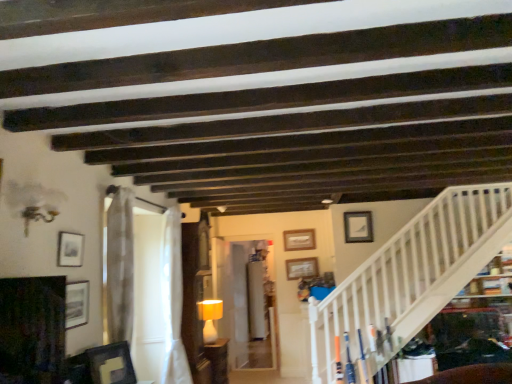
Question: Is matte white picture frame at upper right, the third picture frame viewed from the back, further to camera compared to wooden picture frame at upper center, which ranks as the 1th picture frame in back-to-front order?

Choices:
 (A) no
 (B) yes

Answer: (A)

Question: Does matte white picture frame at upper right, which appears as the 1th picture frame when viewed from the right, appear on the left side of wooden picture frame at upper center, positioned as the 3th picture frame in right-to-left order?

Choices:
 (A) yes
 (B) no

Answer: (B)

Question: Is matte white picture frame at upper right, marked as the sixth picture frame in a left-to-right arrangement, in front of wooden picture frame at upper center, which is counted as the fourth picture frame, starting from the left?

Choices:
 (A) yes
 (B) no

Answer: (A)

Question: From the image's perspective, does matte white picture frame at upper right, the third picture frame viewed from the back, appear higher than wooden picture frame at upper center, which is counted as the fourth picture frame, starting from the left?

Choices:
 (A) no
 (B) yes

Answer: (B)

Question: Does matte white picture frame at upper right, which is counted as the 4th picture frame, starting from the front, have a lesser height compared to wooden picture frame at upper center, the sixth picture frame positioned from the front?

Choices:
 (A) yes
 (B) no

Answer: (B)

Question: From the image's perspective, is matte white picture frame at upper right, marked as the sixth picture frame in a left-to-right arrangement, beneath wooden picture frame at upper center, positioned as the 3th picture frame in right-to-left order?

Choices:
 (A) yes
 (B) no

Answer: (B)

Question: Does matte yellow lampshade at center lie behind matte black picture frame at upper left, which ranks as the 6th picture frame in right-to-left order?

Choices:
 (A) yes
 (B) no

Answer: (A)

Question: Considering the relative sizes of matte yellow lampshade at center and matte black picture frame at upper left, which is the 5th picture frame in back-to-front order, in the image provided, is matte yellow lampshade at center wider than matte black picture frame at upper left, which is the 5th picture frame in back-to-front order,?

Choices:
 (A) no
 (B) yes

Answer: (B)

Question: Does matte yellow lampshade at center have a larger size compared to matte black picture frame at upper left, which ranks as the 6th picture frame in right-to-left order?

Choices:
 (A) no
 (B) yes

Answer: (B)

Question: From a real-world perspective, is matte yellow lampshade at center located beneath matte black picture frame at upper left, which ranks as the 6th picture frame in right-to-left order?

Choices:
 (A) yes
 (B) no

Answer: (A)

Question: From a real-world perspective, does matte yellow lampshade at center stand above matte black picture frame at upper left, which is the 5th picture frame in back-to-front order?

Choices:
 (A) yes
 (B) no

Answer: (B)

Question: Is matte black picture frame at upper left, which is the 5th picture frame in back-to-front order, a part of matte yellow lampshade at center?

Choices:
 (A) no
 (B) yes

Answer: (A)

Question: Does matte white picture frame at upper right, which appears as the 1th picture frame when viewed from the right, have a smaller size compared to sheer white curtain at center, which is the first curtain in front-to-back order?

Choices:
 (A) no
 (B) yes

Answer: (B)